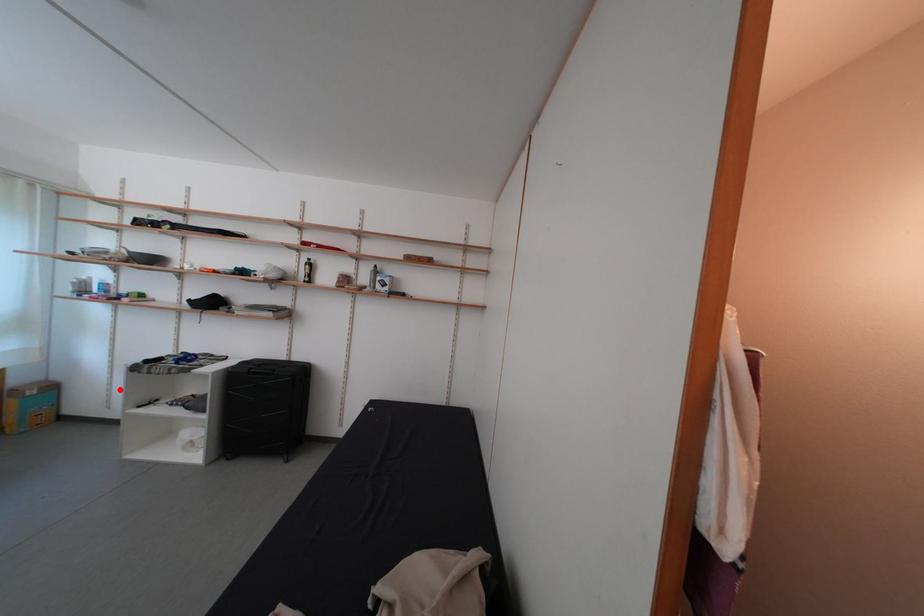
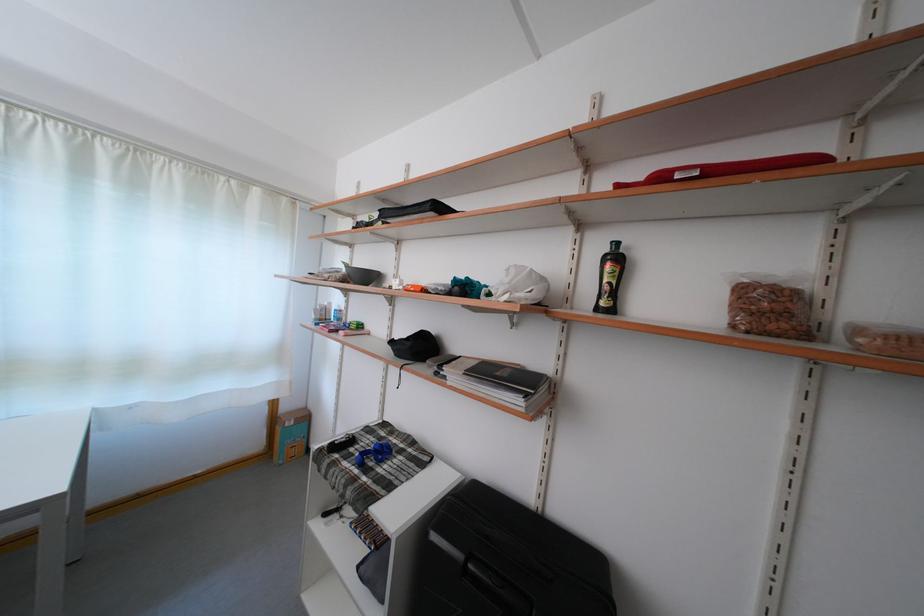
Find the pixel in the second image that matches the highlighted location in the first image.

(344, 436)